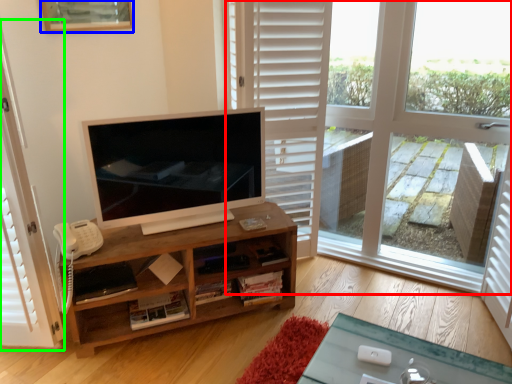
Question: Which is farther away from window (highlighted by a red box)? picture frame (highlighted by a blue box) or screen door (highlighted by a green box)?

Choices:
 (A) picture frame
 (B) screen door

Answer: (B)